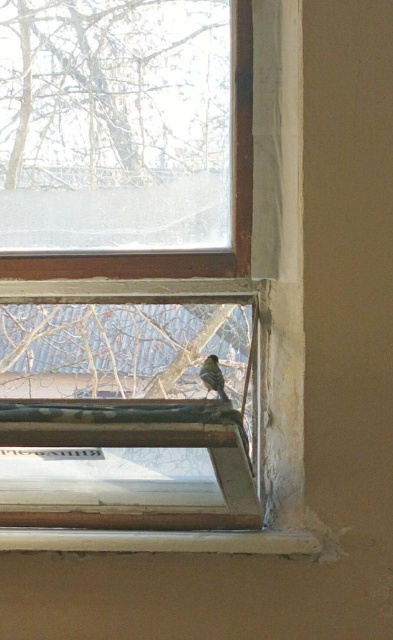
Between clear glass window at center and brown fuzzy bird at lower center, which one appears on the right side from the viewer's perspective?

From the viewer's perspective, brown fuzzy bird at lower center appears more on the right side.

Is point (148, 288) more distant than point (211, 358)?

Yes, point (148, 288) is farther from viewer.

Is point (102, 291) farther from viewer compared to point (216, 388)?

That is True.

Locate an element on the screen. The image size is (393, 640). clear glass window at center is located at coordinates (117, 413).

Is wooden frame at lower center thinner than clear glass window at center?

No, wooden frame at lower center is not thinner than clear glass window at center.

What do you see at coordinates (130, 228) in the screenshot? This screenshot has height=640, width=393. I see `wooden frame at lower center` at bounding box center [130, 228].

Find the location of a particular element. wooden frame at lower center is located at coordinates (130, 228).

I want to click on wooden frame at lower center, so click(x=130, y=228).

Locate an element on the screen. The width and height of the screenshot is (393, 640). wooden frame at lower center is located at coordinates pos(130,228).

Does wooden frame at lower center appear on the left side of brown fuzzy bird at lower center?

Correct, you'll find wooden frame at lower center to the left of brown fuzzy bird at lower center.

Between point (189, 516) and point (207, 385), which one is positioned behind?

Point (207, 385)

Identify the location of wooden frame at lower center. (130, 228).